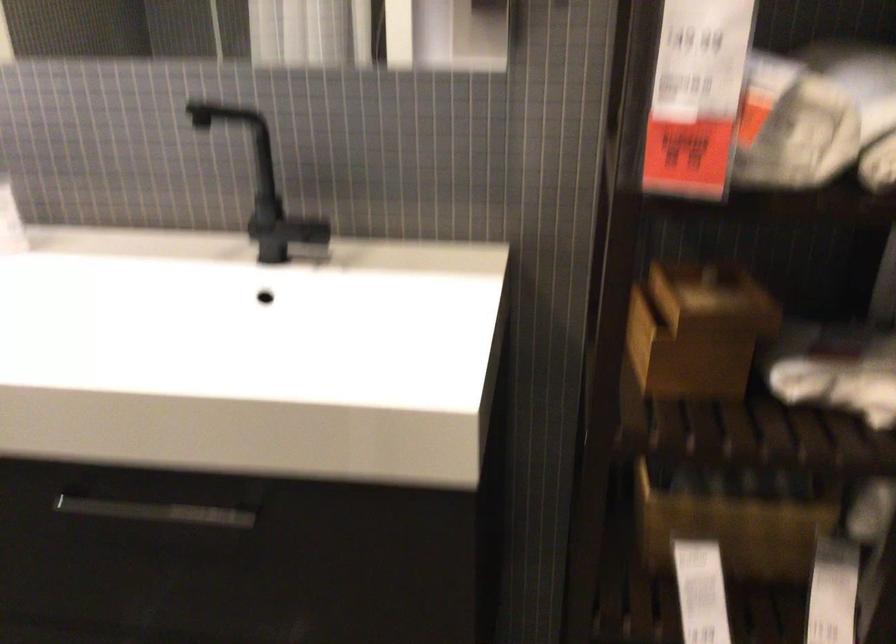
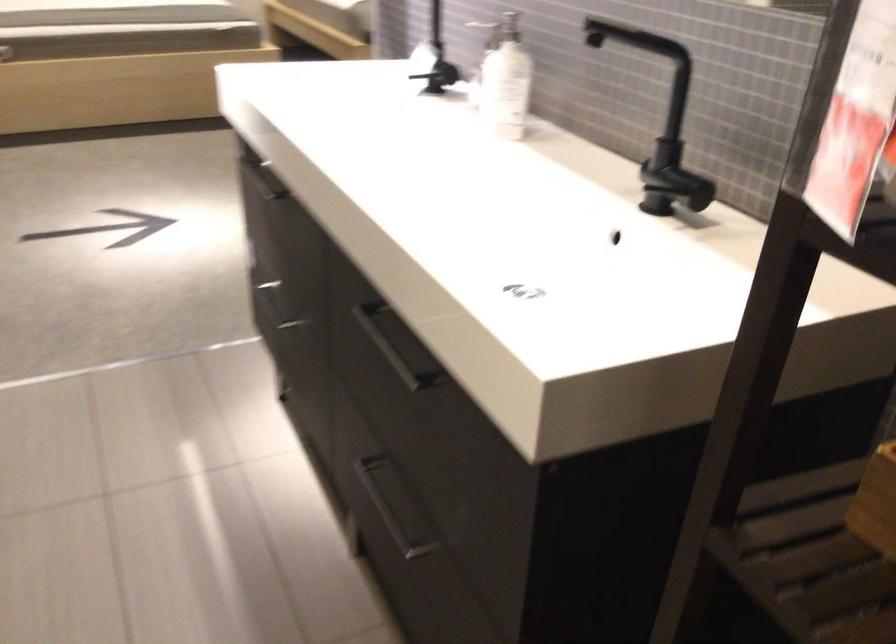
In the second image, find the point that corresponds to point (152, 509) in the first image.

(398, 345)